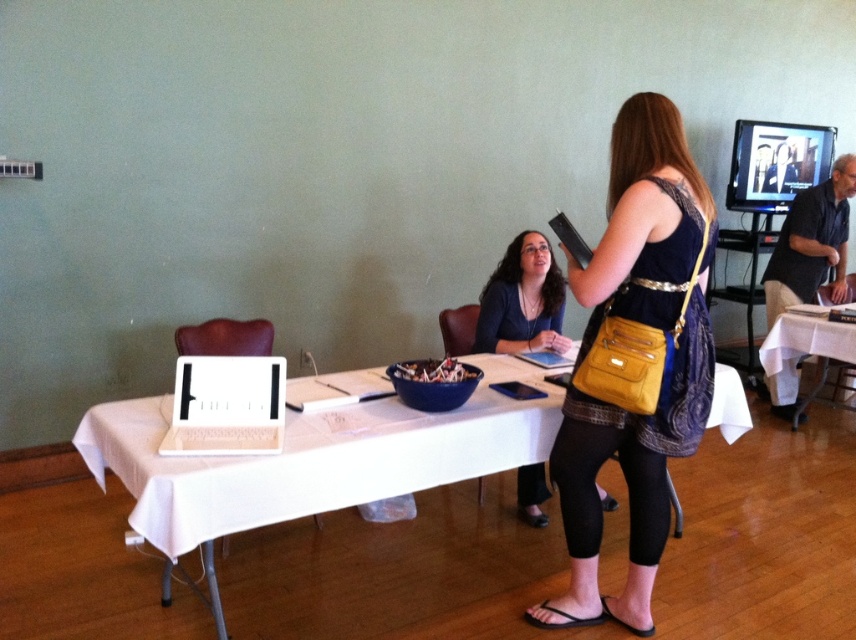
From the picture: You are standing in the conference room and want to hand a document to both the person wearing the matte black dress at center and the dark gray shirt at right. Which one can you reach first without moving from your current position?

You can reach the matte black dress at center first because it is closer to you than the dark gray shirt at right.

Looking at this image, you are a photographer setting up for a meeting photo. You need to position your camera so that both the matte black dress at center and the white matte laptop at center are in frame. Which object should you place on the right side of the camera frame to ensure both are visible?

The matte black dress at center should be placed on the right side of the camera frame because it is already positioned to the right of the white matte laptop at center, ensuring both are visible.